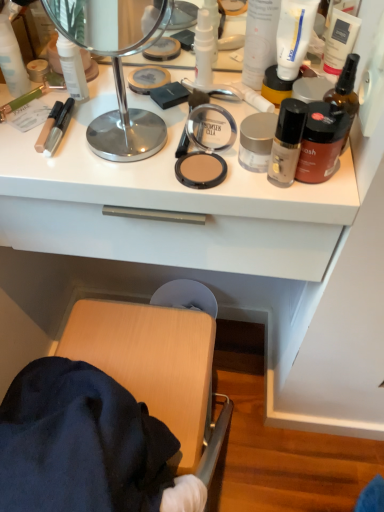
The image size is (384, 512). Identify the location of free space behind matte black concealer at left, which is the 2th toiletry from left to right. [87, 90].